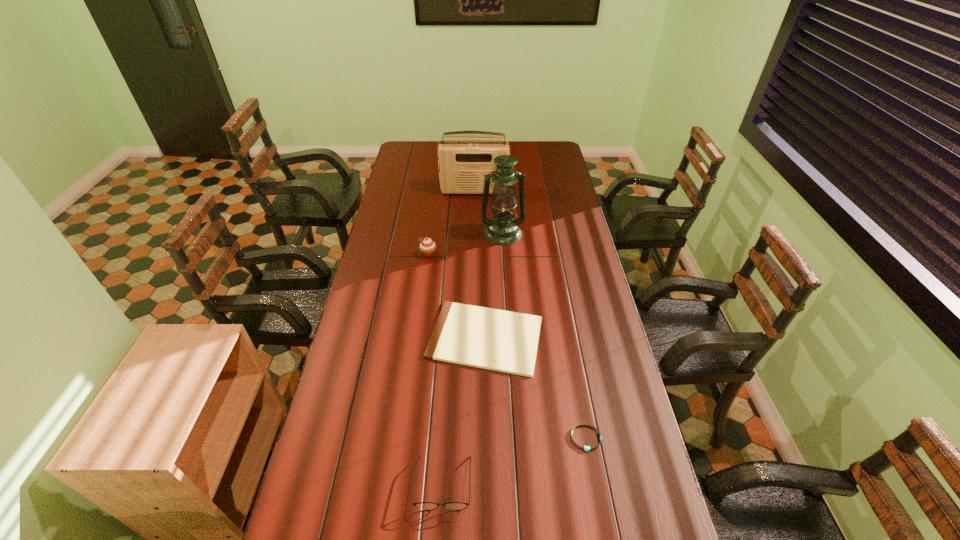
Locate an element on the screen. empty location between the fifth nearest object and the fourth farthest object is located at coordinates (494, 285).

In order to click on vacant region between the fifth nearest object and the radio receiver in this screenshot , I will do `click(489, 212)`.

At what (x,y) coordinates should I click in order to perform the action: click on free space that is in between the fourth farthest object and the third farthest object. Please return your answer as a coordinate pair (x, y). The width and height of the screenshot is (960, 540). Looking at the image, I should click on (457, 295).

You are a GUI agent. You are given a task and a screenshot of the screen. Output one action in this format:
    pyautogui.click(x=<x>, y=<y>)
    Task: Click on the empty location between the rightmost object and the fourth farthest object
    
    Given the screenshot: What is the action you would take?
    pyautogui.click(x=536, y=388)

Identify the location of unoccupied area between the clipboard and the rightmost object. Image resolution: width=960 pixels, height=540 pixels. (536, 388).

Find the location of a particular element. This screenshot has height=540, width=960. vacant space that is in between the fifth farthest object and the oil lamp is located at coordinates (544, 335).

Where is `free spot between the fourth farthest object and the tallest object`? free spot between the fourth farthest object and the tallest object is located at coordinates (494, 285).

This screenshot has width=960, height=540. In order to click on vacant space in between the rightmost object and the fifth nearest object in this screenshot , I will do `click(544, 335)`.

Identify the location of vacant point located between the fourth farthest object and the tallest object. (494, 285).

The width and height of the screenshot is (960, 540). Find the location of `the fifth closest object to the cupcake`. the fifth closest object to the cupcake is located at coordinates (587, 448).